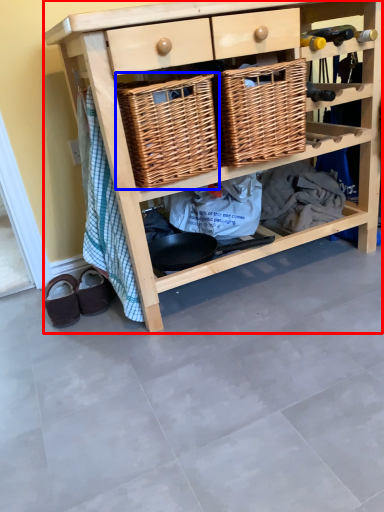
Question: Which of the following is the farthest to the observer, shelf (highlighted by a red box) or basket (highlighted by a blue box)?

Choices:
 (A) shelf
 (B) basket

Answer: (B)